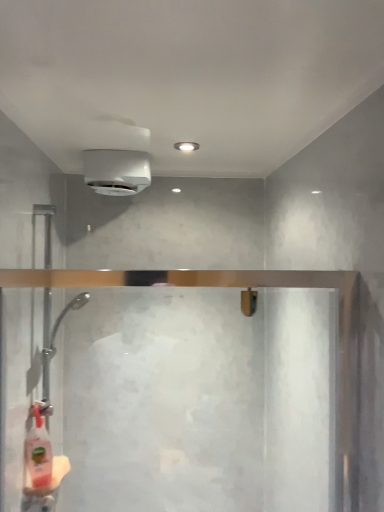
Identify the location of white plastic air vent at upper center. (116, 170).

The height and width of the screenshot is (512, 384). Describe the element at coordinates (116, 170) in the screenshot. I see `white plastic air vent at upper center` at that location.

You are a GUI agent. You are given a task and a screenshot of the screen. Output one action in this format:
    pyautogui.click(x=<x>, y=<y>)
    Task: Click on the white plastic air vent at upper center
    Image resolution: width=384 pixels, height=512 pixels.
    Given the screenshot: What is the action you would take?
    pyautogui.click(x=116, y=170)